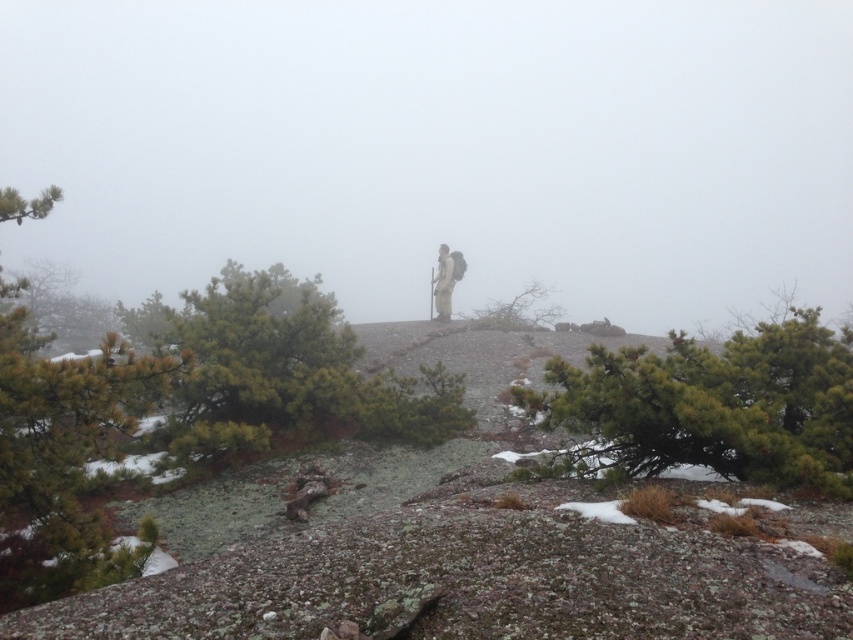
You are a hiker trying to navigate through the misty landscape. You see a green textured pine tree at center and a green matte pine tree at left. Which tree has a narrower trunk?

The green textured pine tree at center has a narrower trunk than the green matte pine tree at left.

You are a hiker who wants to take a photo of the matte gray figure at center without the green textured pine tree at lower right blocking the view. Is this possible from your current position?

The green textured pine tree at lower right is positioned under the matte gray figure at center, so the pine tree will not block the view of the matte gray figure at center from your current position.

You are a hiker trying to navigate through the misty landscape. You see the green textured pine tree at center and the green matte pine tree at left. Which pine tree is closer to you based on their sizes?

The green textured pine tree at center is smaller in size compared to the green matte pine tree at left, so it is closer to you.